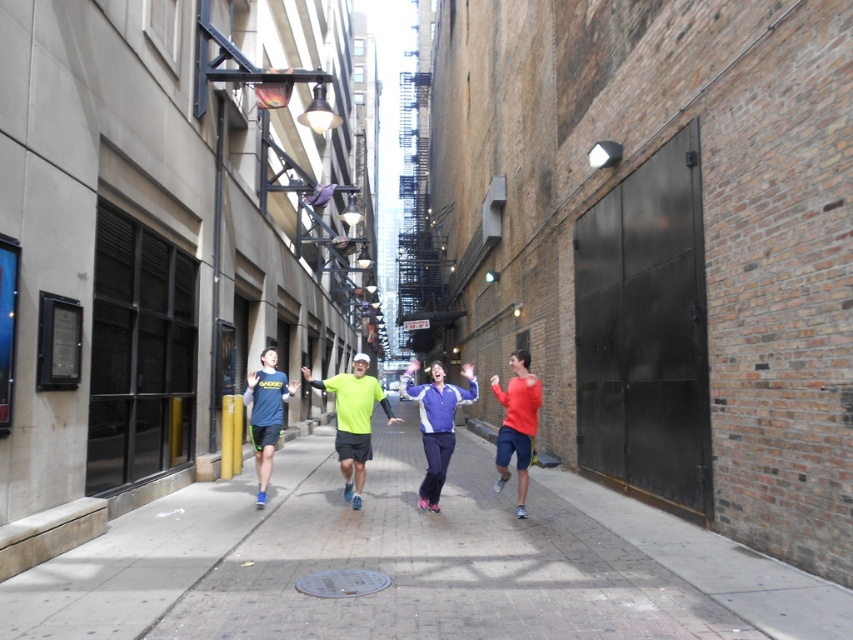
Question: Among these points, which one is nearest to the camera?

Choices:
 (A) (53, 595)
 (B) (351, 449)
 (C) (251, 392)
 (D) (466, 364)

Answer: (A)

Question: Which point is farther to the camera?

Choices:
 (A) vibrant purple track suit at center
 (B) matte blue shirt at center
 (C) neon green fabric at center

Answer: (B)

Question: Among these objects, which one is nearest to the camera?

Choices:
 (A) brick pavement at center
 (B) vibrant purple track suit at center

Answer: (A)

Question: Is brick pavement at center further to camera compared to vibrant purple track suit at center?

Choices:
 (A) yes
 (B) no

Answer: (B)

Question: Does brick pavement at center come behind vibrant purple track suit at center?

Choices:
 (A) no
 (B) yes

Answer: (A)

Question: Is neon green fabric at center below vibrant purple track suit at center?

Choices:
 (A) no
 (B) yes

Answer: (A)